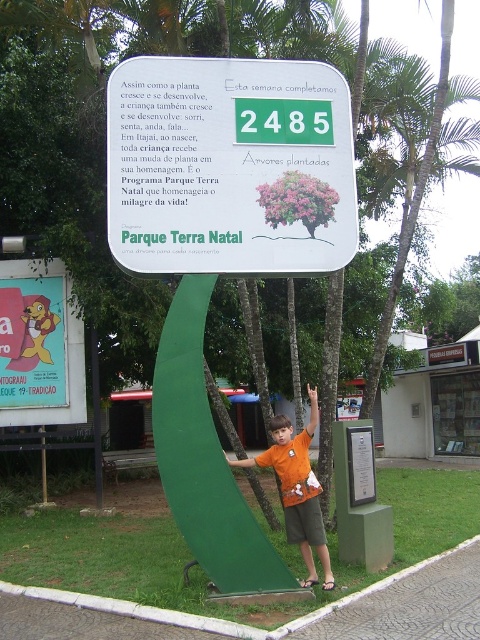
From the picture: Does white plastic sign at center have a greater height compared to orange cotton shirt at center?

Yes, white plastic sign at center is taller than orange cotton shirt at center.

Does point (255, 70) lie in front of point (315, 582)?

No, (255, 70) is behind (315, 582).

The width and height of the screenshot is (480, 640). Identify the location of white plastic sign at center. (229, 166).